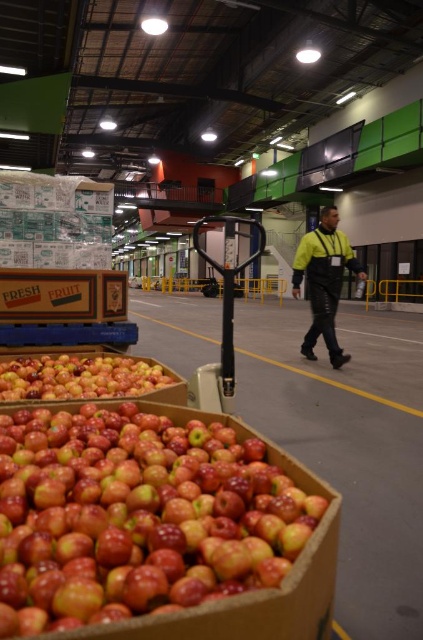
You are a warehouse worker who needs to locate the glossy red apples at center. According to the coordinates provided, where exactly should you look in the image?

The glossy red apples at center are located at the 2D coordinates point (80, 376) in the image.

You are standing in the warehouse and want to take a photo of the shiny red apples at lower left. Your camera is 30 inches away from you. Can you reach the apples with your camera?

The shiny red apples at lower left and camera are 30.25 inches apart. Since your camera is 30 inches away from you, you can reach the apples by extending your arm slightly.